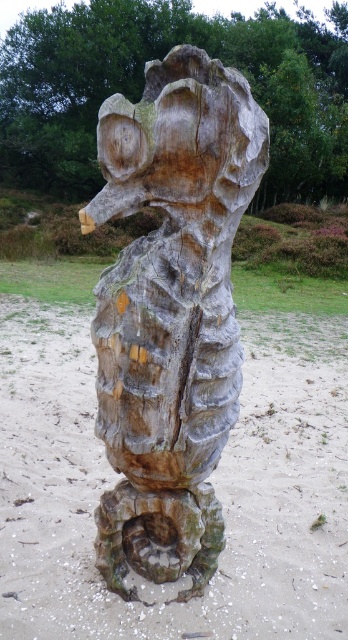
You are an artist planning to carve a new sculpture using the brown wood at center. You want to ensure your new sculpture will be larger than the existing weathered wood sculpture at center. Is this possible based on the current sizes?

The brown wood at center is smaller than the weathered wood sculpture at center, so it is not possible to carve a larger sculpture from it.

Based on the photo, you are standing in the natural setting where the wooden sculpture is displayed. You need to place a small decorative rock exactly at the same coordinates as the brown wood at center. What are the coordinates where you should place the rock?

The coordinates for the brown wood at center are (209,480), so you should place the rock at those exact coordinates.

You are standing in front of the wooden sculpture and want to take a photo that includes both point (294, 321) and point (175, 125). Which point will appear closer to the bottom of the photo?

Point (175, 125) will appear closer to the bottom of the photo because it is closer to the camera than point (294, 321).